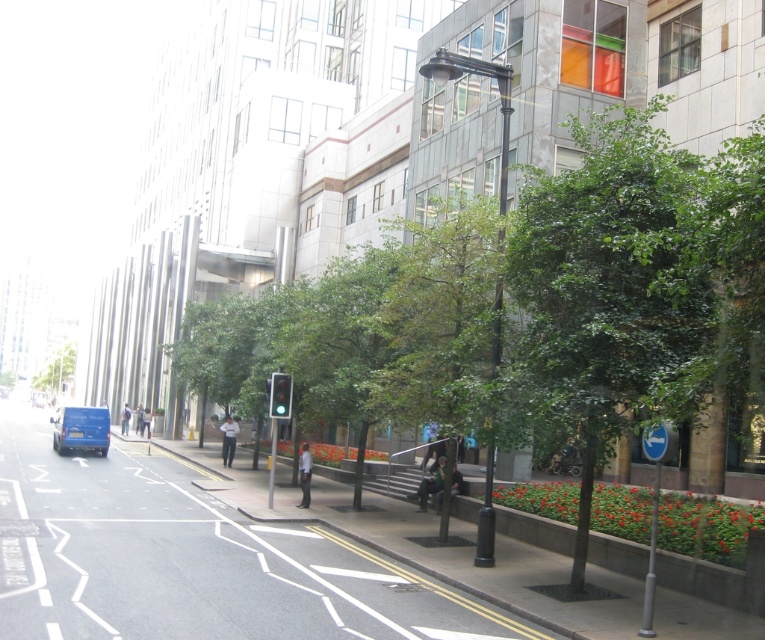
You are standing on the sidewalk looking down the street. Where is the blue plastic sign at lower right located in terms of coordinates?

The blue plastic sign at lower right is located at coordinates point (653, 506).

You are standing on the sidewalk looking down the street. There are two points marked on the ground. The first point is at coordinates point (471, 625) and the second is at point (72, 371). Which point is closer to you?

Point (471, 625) is in front of point (72, 371), so the first point is closer to you.

You are standing on the sidewalk and see a blue plastic sign at lower right. If you want to reach it without moving your feet, can you touch it with your outstretched hand?

The blue plastic sign at lower right is 8.38 meters away from viewer, so you cannot touch it with your outstretched hand as it is too far away.